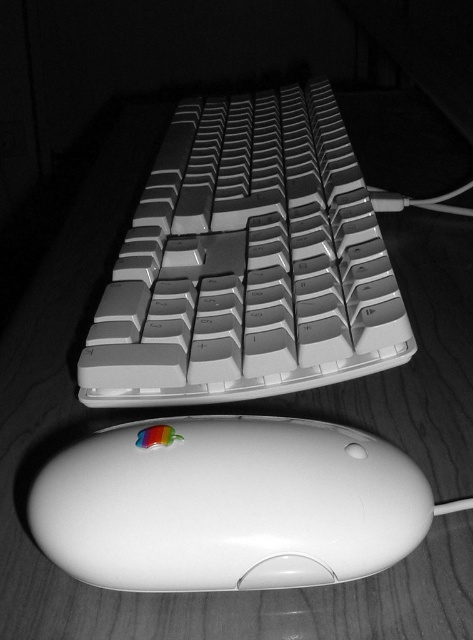
Question: Does white plastic keyboard at center come behind white glossy mouse at lower center?

Choices:
 (A) yes
 (B) no

Answer: (A)

Question: Does white plastic keyboard at center have a greater width compared to white glossy mouse at lower center?

Choices:
 (A) no
 (B) yes

Answer: (B)

Question: Does white plastic keyboard at center appear on the right side of white glossy mouse at lower center?

Choices:
 (A) no
 (B) yes

Answer: (B)

Question: Which of the following is the farthest from the observer?

Choices:
 (A) (400, 324)
 (B) (353, 435)

Answer: (A)

Question: Which point is farther to the camera?

Choices:
 (A) white plastic keyboard at center
 (B) white glossy mouse at lower center

Answer: (A)